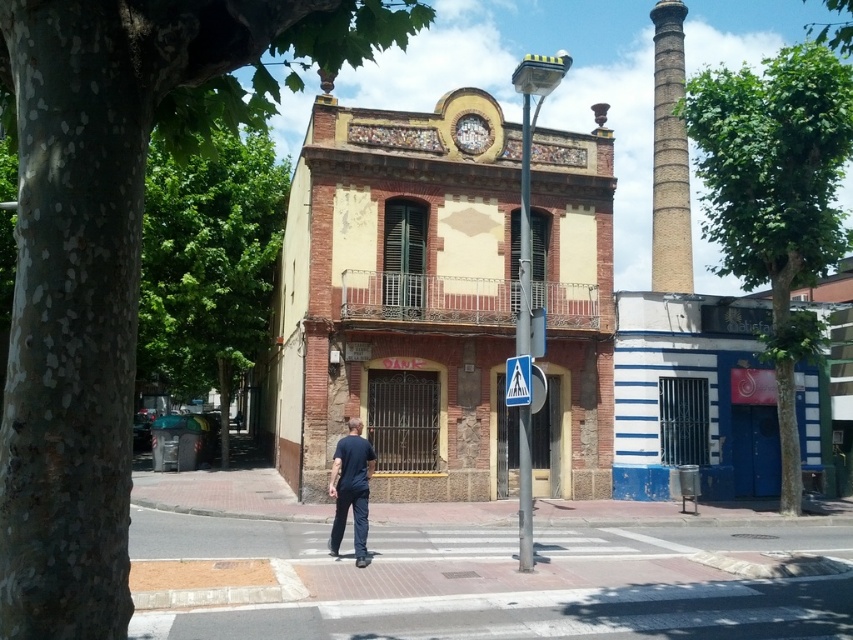
Question: Estimate the real-world distances between objects in this image. Which object is farther from the green leafy tree at right?

Choices:
 (A) gold textured clock at upper center
 (B) smooth concrete chimney at upper right
 (C) dark blue shirt at center

Answer: (C)

Question: From the image, what is the correct spatial relationship of green leafy tree at right in relation to dark blue shirt at center?

Choices:
 (A) right
 (B) left

Answer: (A)

Question: Which point is closer to the camera?

Choices:
 (A) click(x=730, y=88)
 (B) click(x=524, y=376)
 (C) click(x=469, y=150)
 (D) click(x=347, y=486)

Answer: (D)

Question: Considering the real-world distances, which object is closest to the smooth concrete chimney at upper right?

Choices:
 (A) green leafy tree at right
 (B) white plastic pedestrian crossing sign at center

Answer: (A)

Question: Is green leafy tree at left further to the viewer compared to green leafy tree at right?

Choices:
 (A) no
 (B) yes

Answer: (A)

Question: Is smooth concrete chimney at upper right to the right of gold textured clock at upper center from the viewer's perspective?

Choices:
 (A) yes
 (B) no

Answer: (A)